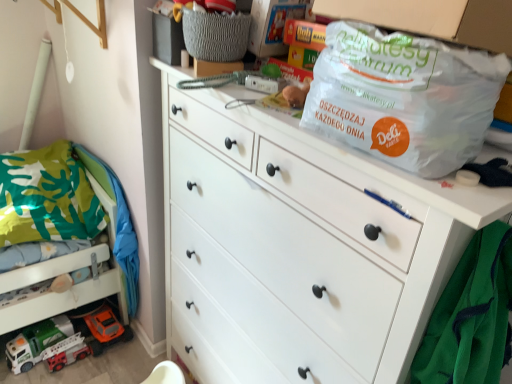
Identify the location of white matte chest of drawers at center. (298, 246).

Describe the element at coordinates (404, 97) in the screenshot. The image size is (512, 384). I see `transparent plastic bag at upper right` at that location.

At what (x,y) coordinates should I click in order to perform the action: click on white matte chest of drawers at center. Please return your answer as a coordinate pair (x, y). The height and width of the screenshot is (384, 512). Looking at the image, I should click on [298, 246].

Can you tell me how much white matte chest of drawers at center and gray woven basket at upper center differ in facing direction?

white matte chest of drawers at center and gray woven basket at upper center are facing 10.7 degrees away from each other.

The image size is (512, 384). In order to click on chest of drawers on the right of gray woven basket at upper center in this screenshot , I will do `click(298, 246)`.

Which is farther from the camera, [259,338] or [226,30]?

Positioned behind is point [259,338].

From a real-world perspective, which object stands above the other?

gray woven basket at upper center, from a real-world perspective.

Would you say gray woven basket at upper center is a long distance from white matte chest of drawers at center?

gray woven basket at upper center is actually quite close to white matte chest of drawers at center.

Between gray woven basket at upper center and white matte chest of drawers at center, which one is positioned in front?

white matte chest of drawers at center is in front.

Looking at this image, is gray woven basket at upper center positioned far away from transparent plastic bag at upper right?

gray woven basket at upper center is actually quite close to transparent plastic bag at upper right.

In the image, there is a gray woven basket at upper center. Where is `bag below it (from the image's perspective)`? bag below it (from the image's perspective) is located at coordinates (404, 97).

Which of these two, gray woven basket at upper center or transparent plastic bag at upper right, is thinner?

gray woven basket at upper center.

Between point (228, 15) and point (426, 120), which one is positioned behind?

The point (228, 15) is behind.

Is green fabric bunk bed at lower left looking in the opposite direction of gray woven basket at upper center?

That's not correct — green fabric bunk bed at lower left is not looking away from gray woven basket at upper center.

From the image's perspective, is green fabric bunk bed at lower left located above or below gray woven basket at upper center?

green fabric bunk bed at lower left is below gray woven basket at upper center.

Where is `bunk bed behind the gray woven basket at upper center`? bunk bed behind the gray woven basket at upper center is located at coordinates (64, 202).

Which of these two, green fabric bunk bed at lower left or gray woven basket at upper center, stands shorter?

With less height is gray woven basket at upper center.

Can you tell me how much transparent plastic bag at upper right and green fabric bunk bed at lower left differ in facing direction?

The facing directions of transparent plastic bag at upper right and green fabric bunk bed at lower left are 1.24 degrees apart.

Is transparent plastic bag at upper right with green fabric bunk bed at lower left?

They are not placed beside each other.

Is point (349, 28) positioned before point (48, 204)?

Yes.

Is transparent plastic bag at upper right in front of or behind green fabric bunk bed at lower left in the image?

transparent plastic bag at upper right is positioned closer to the viewer than green fabric bunk bed at lower left.

From a real-world perspective, who is located lower, green fabric bunk bed at lower left or transparent plastic bag at upper right?

green fabric bunk bed at lower left is physically lower.

Based on the photo, is green fabric bunk bed at lower left touching transparent plastic bag at upper right?

green fabric bunk bed at lower left and transparent plastic bag at upper right are clearly separated.

Is transparent plastic bag at upper right surrounded by green fabric bunk bed at lower left?

No, transparent plastic bag at upper right is located outside of green fabric bunk bed at lower left.

Considering the sizes of objects green fabric bunk bed at lower left and transparent plastic bag at upper right in the image provided, who is bigger, green fabric bunk bed at lower left or transparent plastic bag at upper right?

With larger size is green fabric bunk bed at lower left.

Which object is more forward, green fabric bunk bed at lower left or white matte chest of drawers at center?

white matte chest of drawers at center is closer to the camera.

Looking at their sizes, would you say green fabric bunk bed at lower left is wider or thinner than white matte chest of drawers at center?

green fabric bunk bed at lower left is wider than white matte chest of drawers at center.

Can you tell me how much green fabric bunk bed at lower left and white matte chest of drawers at center differ in facing direction?

green fabric bunk bed at lower left and white matte chest of drawers at center are facing 1.24 degrees away from each other.

Looking at this image, considering the sizes of green fabric bunk bed at lower left and white matte chest of drawers at center in the image, is green fabric bunk bed at lower left taller or shorter than white matte chest of drawers at center?

Clearly, green fabric bunk bed at lower left is shorter compared to white matte chest of drawers at center.

What are the coordinates of `the chest of drawers lying below the gray woven basket at upper center (from the image's perspective)` in the screenshot? It's located at (298, 246).

Find the location of a particular element. chest of drawers on the right of gray woven basket at upper center is located at coordinates (298, 246).

Estimate the real-world distances between objects in this image. Which object is closer to gray woven basket at upper center, white matte chest of drawers at center or green fabric bunk bed at lower left?

white matte chest of drawers at center is closer to gray woven basket at upper center.

When comparing their distances from white matte chest of drawers at center, does transparent plastic bag at upper right or gray woven basket at upper center seem closer?

Among the two, transparent plastic bag at upper right is located nearer to white matte chest of drawers at center.

Looking at the image, which one is located further to green fabric bunk bed at lower left, gray woven basket at upper center or transparent plastic bag at upper right?

transparent plastic bag at upper right is positioned further to the anchor green fabric bunk bed at lower left.

Considering their positions, is gray woven basket at upper center positioned closer to green fabric bunk bed at lower left than white matte chest of drawers at center?

white matte chest of drawers at center is positioned closer to the anchor green fabric bunk bed at lower left.

Estimate the real-world distances between objects in this image. Which object is further from transparent plastic bag at upper right, green fabric bunk bed at lower left or gray woven basket at upper center?

Among the two, green fabric bunk bed at lower left is located further to transparent plastic bag at upper right.

When comparing their distances from green fabric bunk bed at lower left, does white matte chest of drawers at center or transparent plastic bag at upper right seem closer?

white matte chest of drawers at center lies closer to green fabric bunk bed at lower left than the other object.

Estimate the real-world distances between objects in this image. Which object is closer to transparent plastic bag at upper right, gray woven basket at upper center or white matte chest of drawers at center?

The object closer to transparent plastic bag at upper right is white matte chest of drawers at center.

When comparing their distances from gray woven basket at upper center, does green fabric bunk bed at lower left or white matte chest of drawers at center seem closer?

The object closer to gray woven basket at upper center is white matte chest of drawers at center.

Locate an element on the screen. The height and width of the screenshot is (384, 512). chest of drawers between green fabric bunk bed at lower left and transparent plastic bag at upper right is located at coordinates (298, 246).

In order to click on bag between gray woven basket at upper center and white matte chest of drawers at center vertically in this screenshot , I will do [404, 97].

Where is `basket between green fabric bunk bed at lower left and white matte chest of drawers at center from left to right`? The width and height of the screenshot is (512, 384). basket between green fabric bunk bed at lower left and white matte chest of drawers at center from left to right is located at coordinates (216, 35).

This screenshot has height=384, width=512. Find the location of `basket between green fabric bunk bed at lower left and transparent plastic bag at upper right in the horizontal direction`. basket between green fabric bunk bed at lower left and transparent plastic bag at upper right in the horizontal direction is located at coordinates (216, 35).